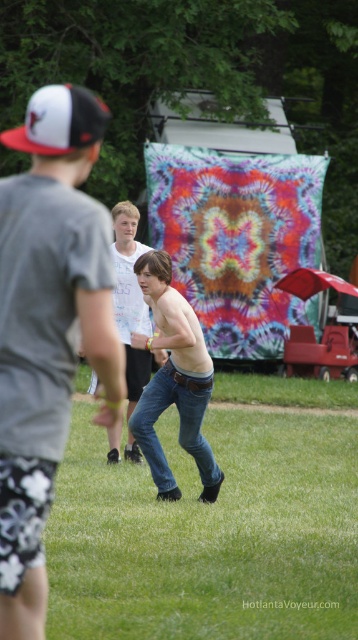
Is shiny silver belt at center wider than jeans at center?

Incorrect, shiny silver belt at center's width does not surpass jeans at center's.

Can you confirm if shiny silver belt at center is positioned below jeans at center?

Correct, shiny silver belt at center is located below jeans at center.

Image resolution: width=358 pixels, height=640 pixels. I want to click on shiny silver belt at center, so click(x=54, y=276).

This screenshot has width=358, height=640. I want to click on shiny silver belt at center, so click(x=54, y=276).

Which is below, shiny silver belt at center or denim jeans at center?

denim jeans at center is lower down.

Is shiny silver belt at center closer to camera compared to denim jeans at center?

Yes, shiny silver belt at center is closer to the viewer.

The height and width of the screenshot is (640, 358). What do you see at coordinates (54, 276) in the screenshot?
I see `shiny silver belt at center` at bounding box center [54, 276].

I want to click on shiny silver belt at center, so click(54, 276).

Describe the element at coordinates (209, 536) in the screenshot. This screenshot has height=640, width=358. I see `green grass at center` at that location.

Does point (248, 541) come behind point (133, 237)?

No, it is in front of (133, 237).

Find the location of a particular element. green grass at center is located at coordinates (209, 536).